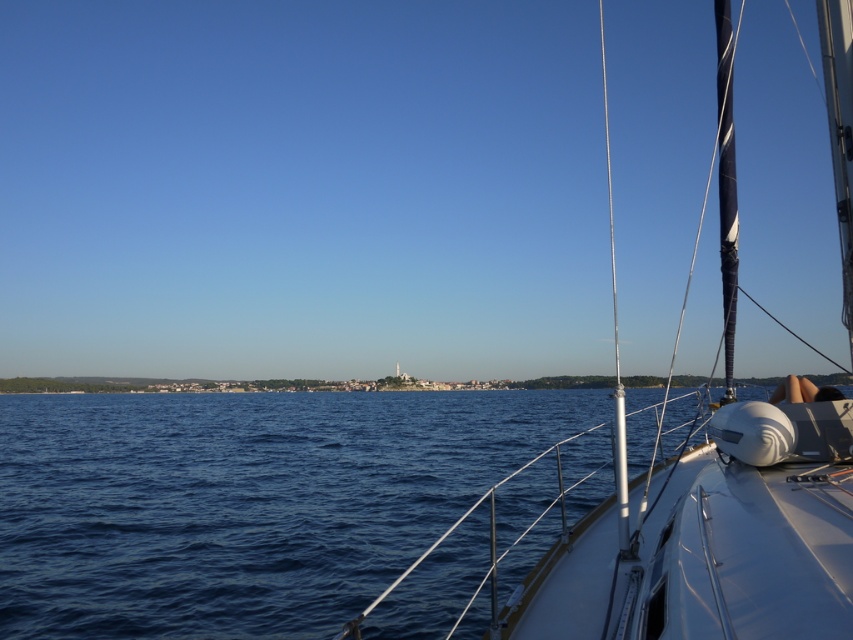
Does point (747, 461) come closer to viewer compared to point (619, 392)?

Yes, it is.

Does white glossy sailboat at center have a greater height compared to silver/metallic mast at right?

In fact, white glossy sailboat at center may be shorter than silver/metallic mast at right.

Where is `white glossy sailboat at center`? This screenshot has width=853, height=640. white glossy sailboat at center is located at coordinates click(712, 536).

Image resolution: width=853 pixels, height=640 pixels. Identify the location of white glossy sailboat at center. (712, 536).

Between blue water at center and silver/metallic mast at right, which one is positioned higher?

Positioned higher is silver/metallic mast at right.

Does blue water at center have a lesser width compared to silver/metallic mast at right?

No, blue water at center is not thinner than silver/metallic mast at right.

Find the location of a particular element. Image resolution: width=853 pixels, height=640 pixels. blue water at center is located at coordinates (252, 500).

Measure the distance between blue water at center and white glossy sailboat at center.

41.11 meters

Does blue water at center lie in front of white glossy sailboat at center?

No, it is not.

Does point (434, 468) come in front of point (753, 422)?

That is False.

Where is `blue water at center`? This screenshot has width=853, height=640. blue water at center is located at coordinates (252, 500).